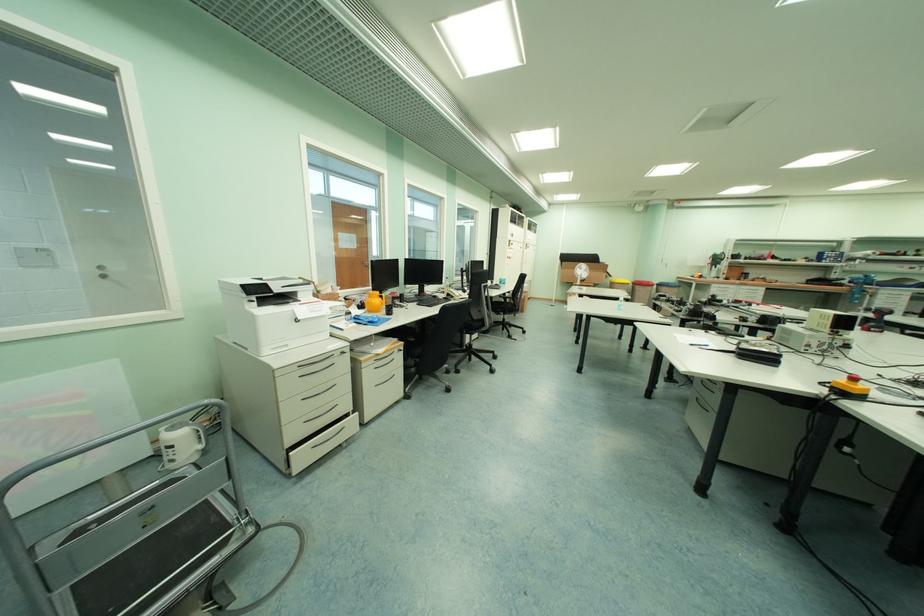
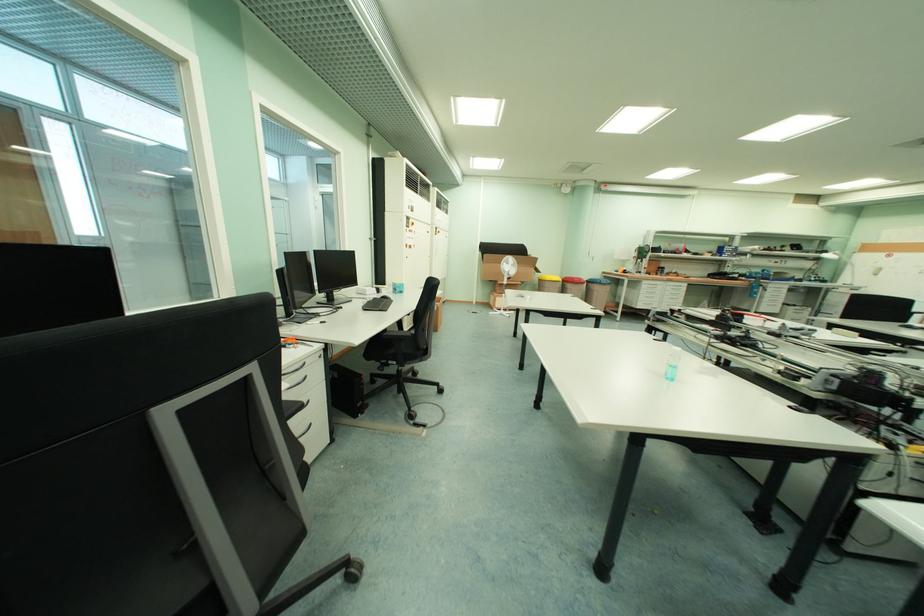
Question: What movement of the cameraman would produce the second image?

Choices:
 (A) Left
 (B) Right
 (C) Forward
 (D) Backward

Answer: (C)